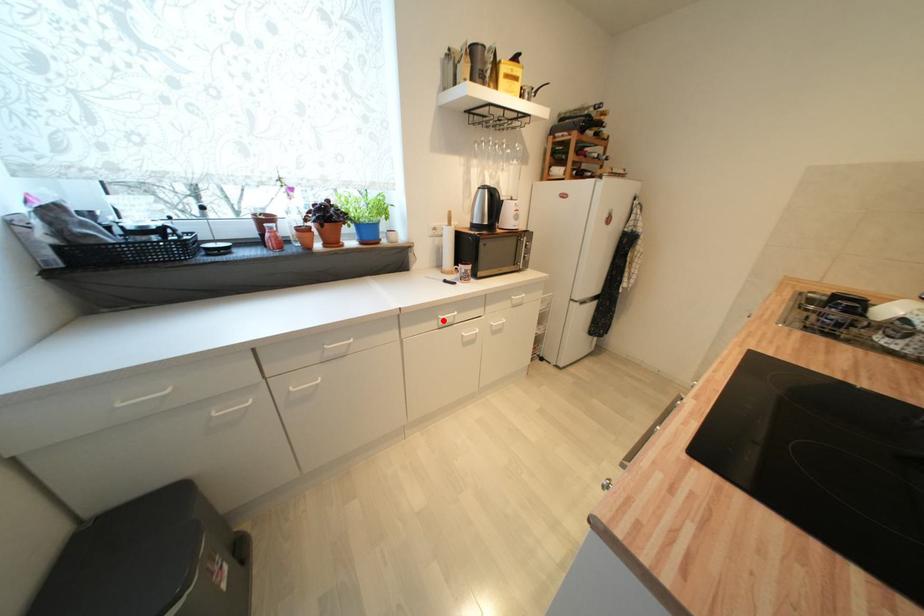
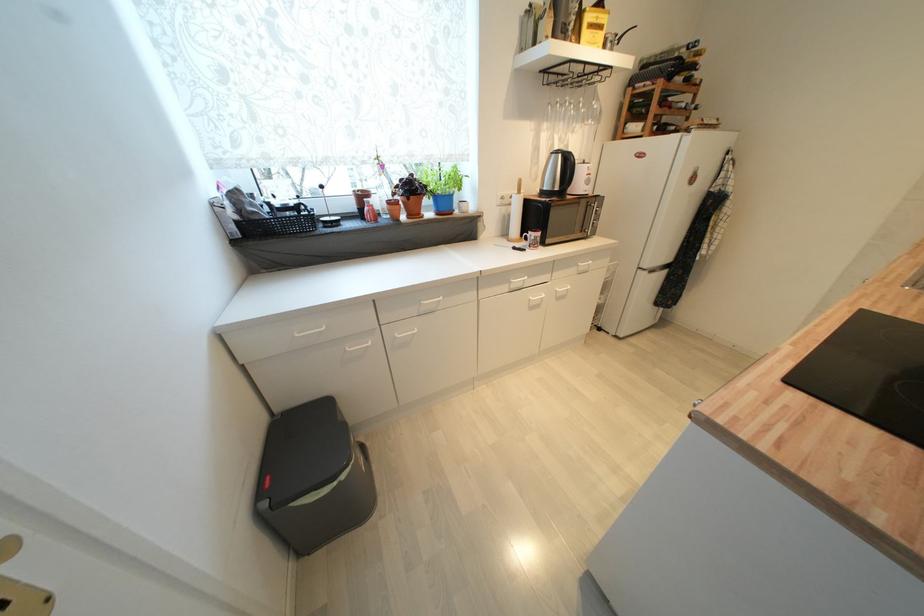
In the second image, find the point that corresponds to the highlighted location in the first image.

(516, 284)